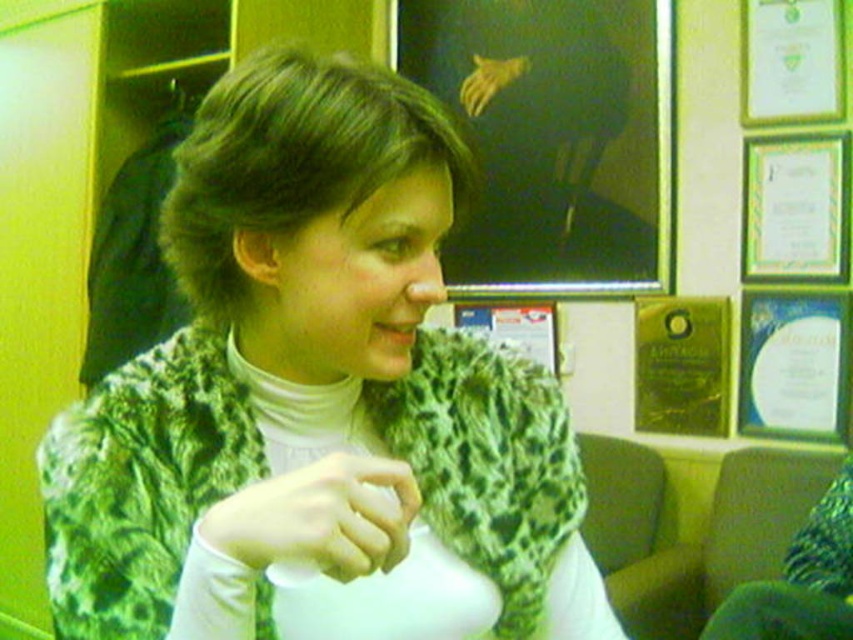
Can you confirm if matte black board at upper center is positioned to the left of green matte hand at center?

No, matte black board at upper center is not to the left of green matte hand at center.

Which is more to the right, matte black board at upper center or green matte hand at center?

A: matte black board at upper center is more to the right.

Does point (479, 193) come closer to viewer compared to point (277, 486)?

No, (479, 193) is further to viewer.

Image resolution: width=853 pixels, height=640 pixels. Find the location of `matte black board at upper center`. matte black board at upper center is located at coordinates (553, 138).

Is green textured scarf at center bigger than green matte hand at center?

Indeed, green textured scarf at center has a larger size compared to green matte hand at center.

Does green textured scarf at center appear on the right side of green matte hand at center?

Correct, you'll find green textured scarf at center to the right of green matte hand at center.

Which is in front, point (276, 420) or point (280, 474)?

Positioned in front is point (280, 474).

Find the location of a particular element. The image size is (853, 640). green textured scarf at center is located at coordinates (317, 403).

Is green textured scarf at center closer to camera compared to matte black board at upper center?

Yes.

Can you confirm if green textured scarf at center is positioned to the left of matte black board at upper center?

Indeed, green textured scarf at center is positioned on the left side of matte black board at upper center.

The height and width of the screenshot is (640, 853). Find the location of `green textured scarf at center`. green textured scarf at center is located at coordinates (317, 403).